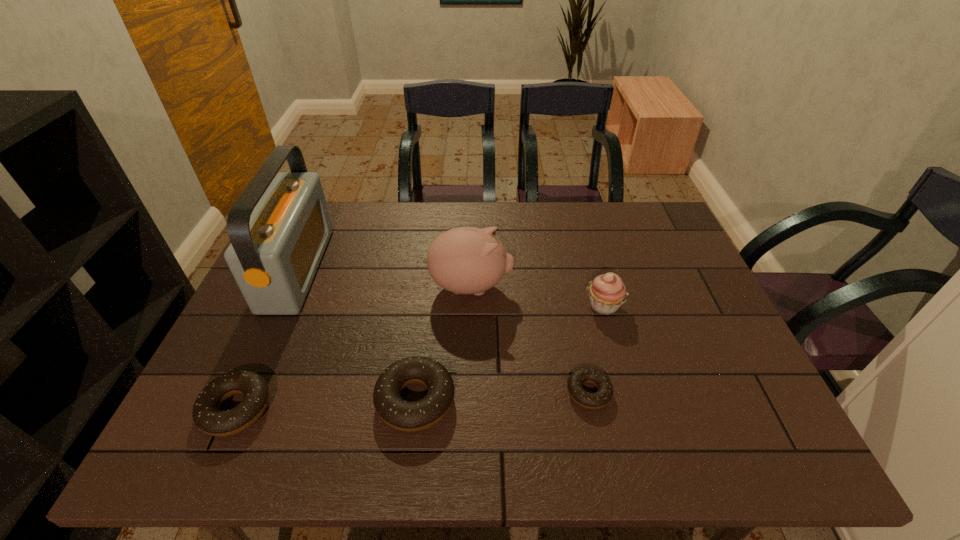
Where is `vacant area that lies between the fourth shortest object and the shortest doughnut`? The width and height of the screenshot is (960, 540). vacant area that lies between the fourth shortest object and the shortest doughnut is located at coordinates click(596, 349).

The height and width of the screenshot is (540, 960). I want to click on vacant space that is in between the radio receiver and the second doughnut from left to right, so click(x=357, y=334).

Select which object is the closest to the fifth shortest object. Please provide its 2D coordinates. Your answer should be formatted as a tuple, i.e. [(x, y)], where the tuple contains the x and y coordinates of a point satisfying the conditions above.

[(399, 414)]

At what (x,y) coordinates should I click in order to perform the action: click on object that is the second closest to the third tallest object. Please return your answer as a coordinate pair (x, y). This screenshot has height=540, width=960. Looking at the image, I should click on (466, 260).

Identify which doughnut is the nearest to the second tallest doughnut. Please provide its 2D coordinates. Your answer should be formatted as a tuple, i.e. [(x, y)], where the tuple contains the x and y coordinates of a point satisfying the conditions above.

[(399, 414)]

Identify the location of doughnut that stands as the second closest to the third tallest object. The height and width of the screenshot is (540, 960). (399, 414).

This screenshot has width=960, height=540. I want to click on vacant space that satisfies the following two spatial constraints: 1. on the front-facing side of the tallest object; 2. on the right side of the third tallest object, so click(280, 306).

Identify the location of free space in the image that satisfies the following two spatial constraints: 1. at the snout of the piggy bank; 2. on the right side of the rightmost doughnut. (468, 392).

This screenshot has height=540, width=960. In order to click on vacant point that satisfies the following two spatial constraints: 1. on the front-facing side of the second doughnut from left to right; 2. on the right side of the tallest object in this screenshot , I will do `click(238, 400)`.

Identify the location of vacant area that satisfies the following two spatial constraints: 1. on the back side of the shortest doughnut; 2. at the snout of the piggy bank. The height and width of the screenshot is (540, 960). (567, 287).